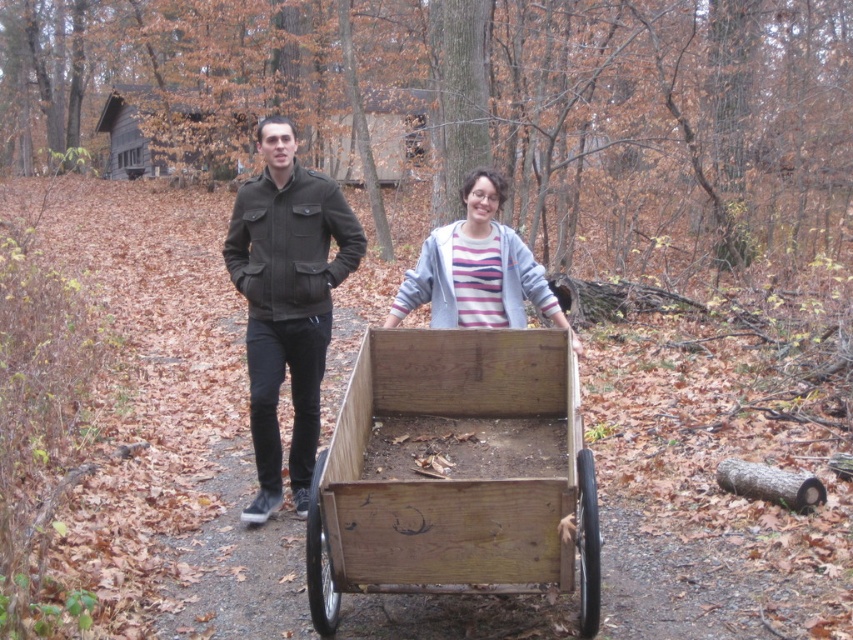
Does dark olive-green jacket at center have a smaller size compared to striped cotton hoodie at center?

Actually, dark olive-green jacket at center might be larger than striped cotton hoodie at center.

In the scene shown: Who is more forward, (x=292, y=147) or (x=463, y=221)?

Point (x=292, y=147) is more forward.

Where is `dark olive-green jacket at center`? This screenshot has height=640, width=853. dark olive-green jacket at center is located at coordinates (287, 301).

Looking at this image, is the position of wooden wagon at center less distant than that of dark olive-green jacket at center?

That is True.

Does wooden wagon at center have a smaller size compared to dark olive-green jacket at center?

No, wooden wagon at center is not smaller than dark olive-green jacket at center.

Does point (424, 352) lie behind point (305, 186)?

No, (424, 352) is in front of (305, 186).

Where is `wooden wagon at center`? wooden wagon at center is located at coordinates (456, 474).

Between wooden wagon at center and striped cotton hoodie at center, which one has more height?

With more height is wooden wagon at center.

Does point (451, 582) come in front of point (543, 278)?

Yes, point (451, 582) is closer to viewer.

Where is `wooden wagon at center`? The image size is (853, 640). wooden wagon at center is located at coordinates (456, 474).